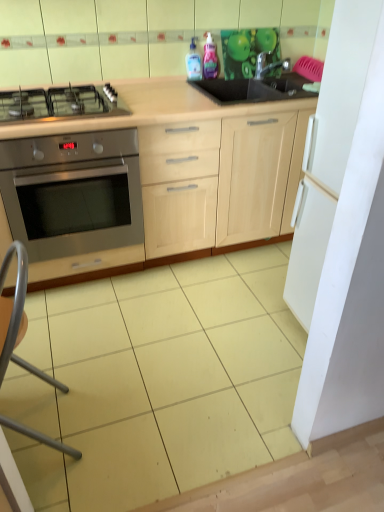
Find the location of a particular element. Image resolution: width=384 pixels, height=512 pixels. unoccupied region to the right of pink glossy bottle at upper center, the first bottle when ordered from right to left is located at coordinates (236, 74).